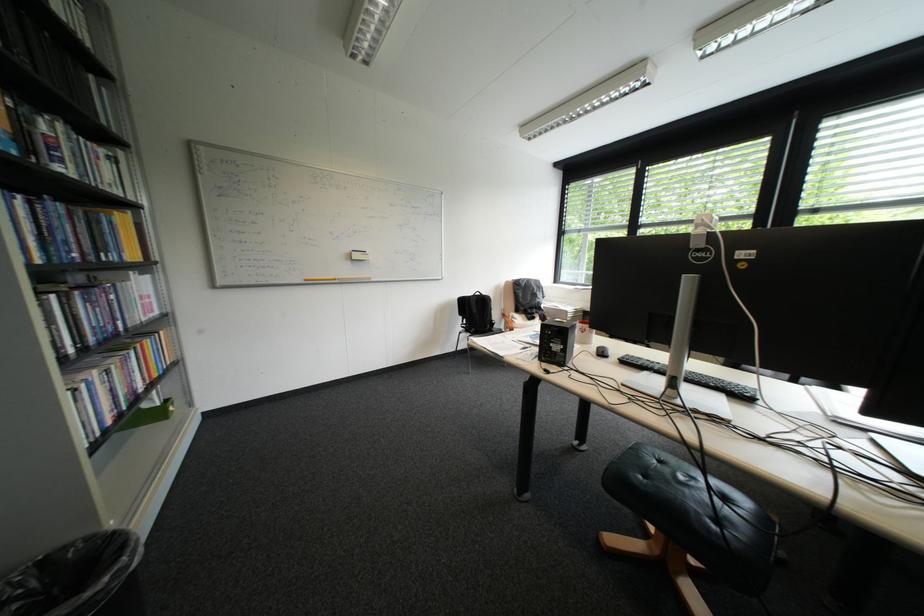
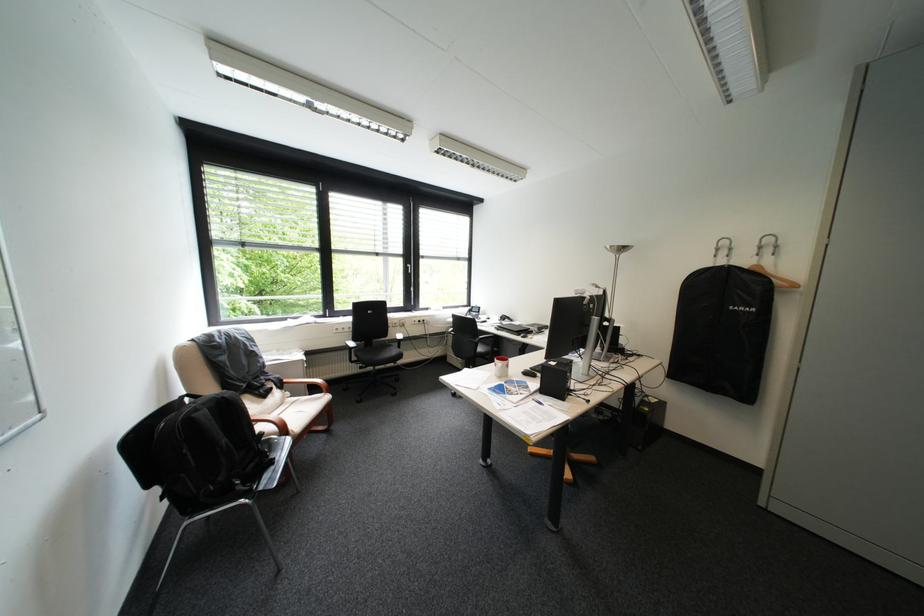
Locate, in the second image, the point that corresponds to pixel 557 317 in the first image.

(294, 381)